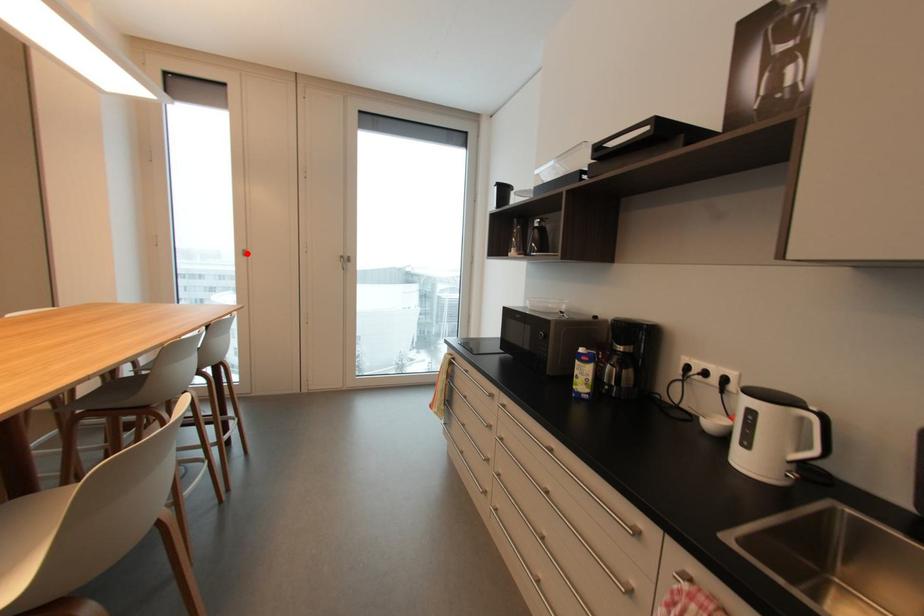
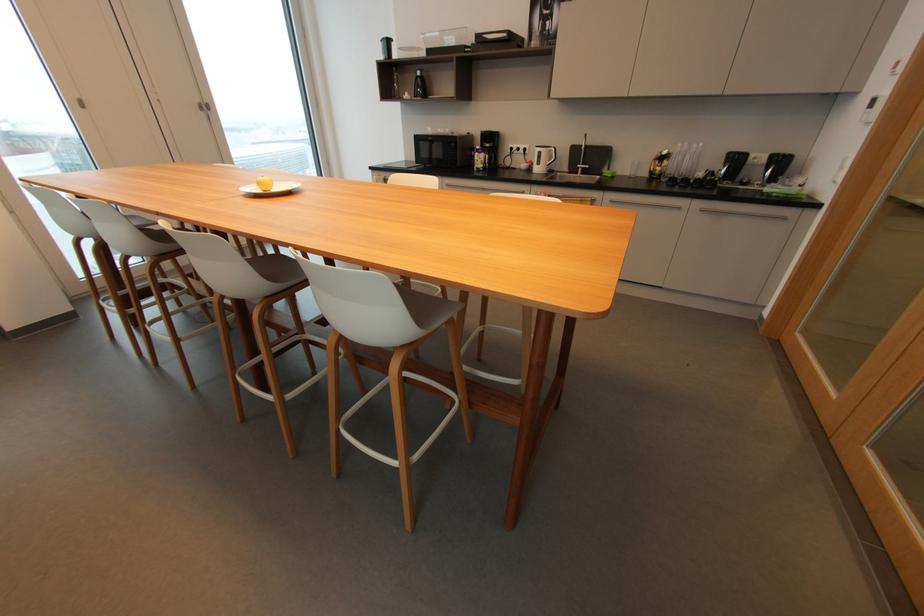
Question: I am providing you with two images of the same scene from different viewpoints. A red point is marked on the first image. Can you still see the location of the red point in image 2?

Choices:
 (A) Yes
 (B) No

Answer: (A)